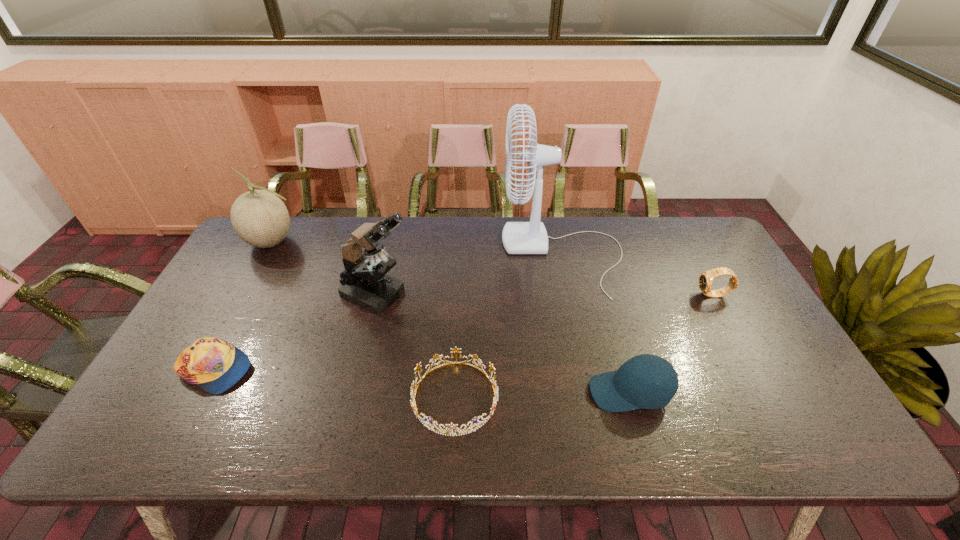
This screenshot has height=540, width=960. What are the coordinates of `vacant space that's between the fifth object from right to left and the fifth shortest object` in the screenshot? It's located at (324, 267).

Locate an element on the screen. This screenshot has height=540, width=960. free space between the fifth tallest object and the cantaloup is located at coordinates (x=492, y=268).

Where is `free space between the cantaloup and the tallest object`? Image resolution: width=960 pixels, height=540 pixels. free space between the cantaloup and the tallest object is located at coordinates (418, 248).

Identify which object is the fourth nearest to the microscope. Please provide its 2D coordinates. Your answer should be formatted as a tuple, i.e. [(x, y)], where the tuple contains the x and y coordinates of a point satisfying the conditions above.

[(531, 237)]

Select which object appears as the fourth closest to the fourth object from left to right. Please provide its 2D coordinates. Your answer should be formatted as a tuple, i.e. [(x, y)], where the tuple contains the x and y coordinates of a point satisfying the conditions above.

[(215, 365)]

Find the location of a particular element. The width and height of the screenshot is (960, 540). blank space that satisfies the following two spatial constraints: 1. on the front-facing side of the tallest object; 2. on the front side of the microscope is located at coordinates (571, 293).

Find the location of a particular element. vacant space that satisfies the following two spatial constraints: 1. on the face of the third shortest object; 2. on the front-facing side of the fourth object from right to left is located at coordinates (769, 397).

At what (x,y) coordinates should I click in order to perform the action: click on vacant space that satisfies the following two spatial constraints: 1. on the face of the third shortest object; 2. on the front-facing side of the tiara. Please return your answer as a coordinate pair (x, y). The image size is (960, 540). Looking at the image, I should click on (769, 397).

Find the location of a particular element. free space that satisfies the following two spatial constraints: 1. on the front-facing side of the baseball cap; 2. on the front-facing side of the tiara is located at coordinates (631, 397).